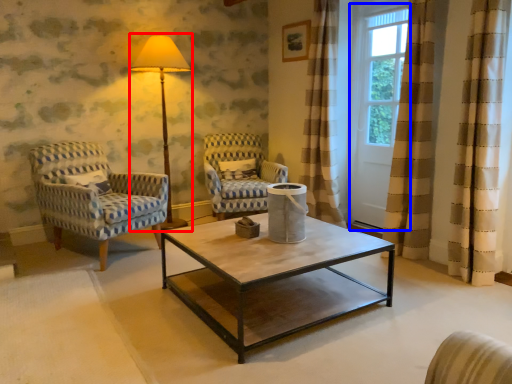
Question: Which object is closer to the camera taking this photo, table lamp (highlighted by a red box) or screen door (highlighted by a blue box)?

Choices:
 (A) table lamp
 (B) screen door

Answer: (B)